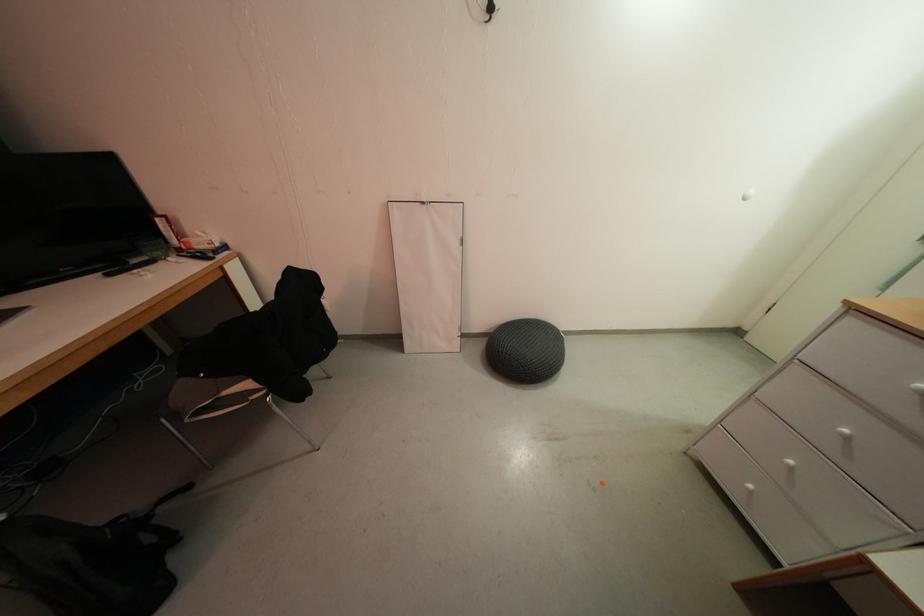
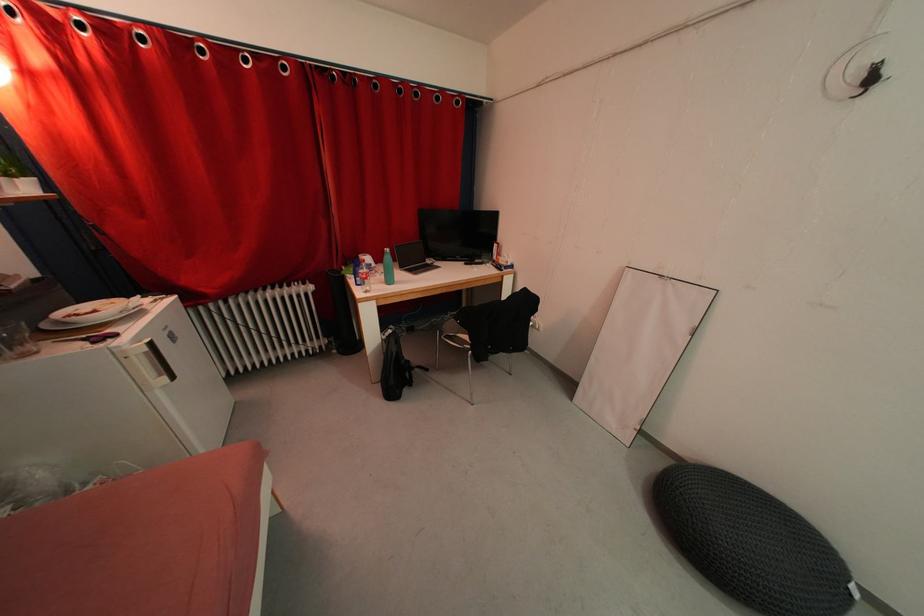
Question: Based on the continuous images, in which direction is the camera rotating? Reply with the corresponding letter.

Choices:
 (A) Left
 (B) Right
 (C) Up
 (D) Down

Answer: (A)